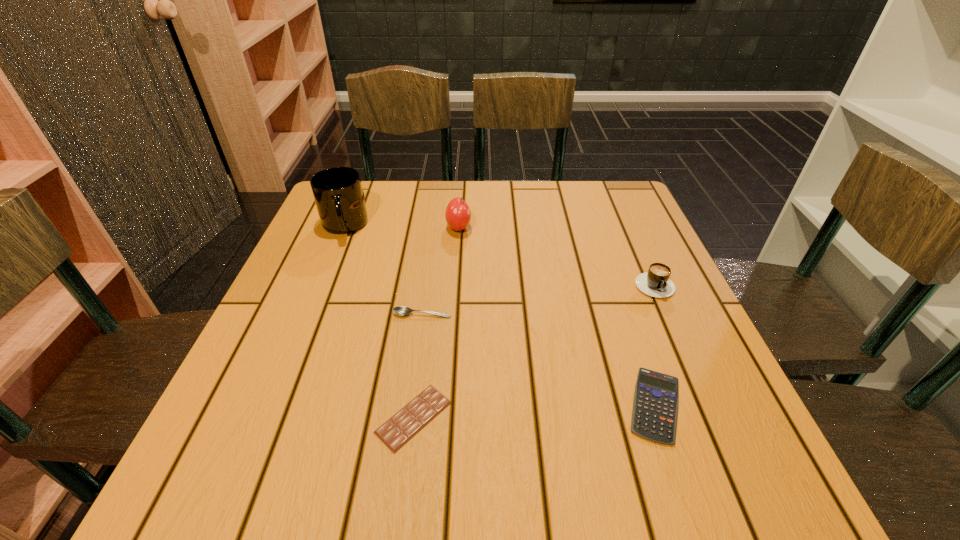
In the image, there is a desktop. At what (x,y) coordinates should I click in order to perform the action: click on vacant space at the near right corner. Please return your answer as a coordinate pair (x, y). Image resolution: width=960 pixels, height=540 pixels. Looking at the image, I should click on (759, 495).

Locate an element on the screen. This screenshot has height=540, width=960. blank region between the apple and the second shortest object is located at coordinates (557, 316).

Find the location of a particular element. blank region between the leftmost object and the cappuccino is located at coordinates (498, 254).

Where is `unoccupied position between the cappuccino and the fourth farthest object`? This screenshot has height=540, width=960. unoccupied position between the cappuccino and the fourth farthest object is located at coordinates (538, 298).

Find the location of a particular element. vacant area that lies between the calculator and the mug is located at coordinates (499, 315).

What are the coordinates of `vacant area that lies between the fifth tallest object and the mug` in the screenshot? It's located at (499, 315).

Find the location of a particular element. free space between the third tallest object and the leftmost object is located at coordinates tap(498, 254).

This screenshot has width=960, height=540. In order to click on unoccupied area between the shortest object and the soupspoon in this screenshot , I will do `click(418, 366)`.

Identify the location of vacant area that lies between the tallest object and the apple. (401, 227).

The image size is (960, 540). Find the location of `unoccupied area between the fourth shortest object and the shortest object`. unoccupied area between the fourth shortest object and the shortest object is located at coordinates (533, 349).